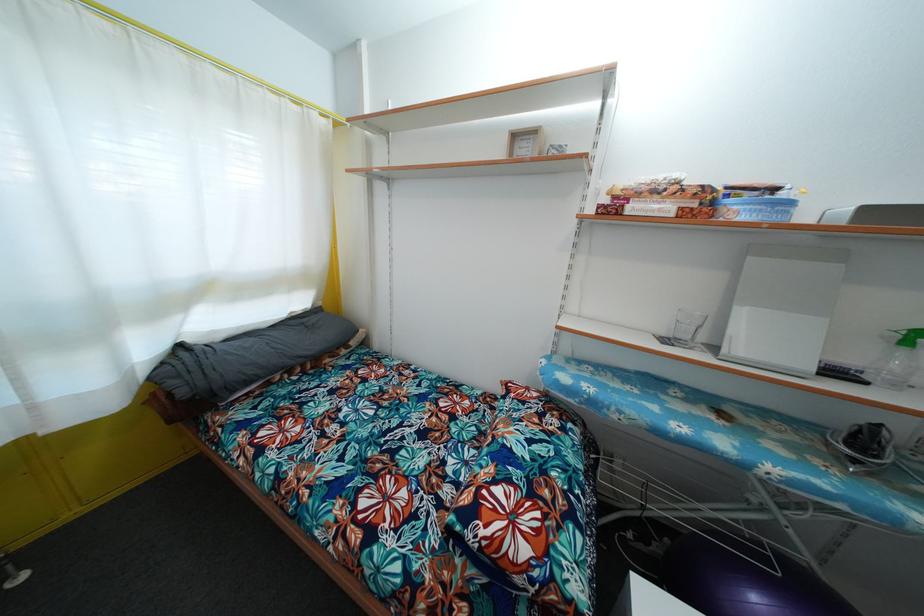
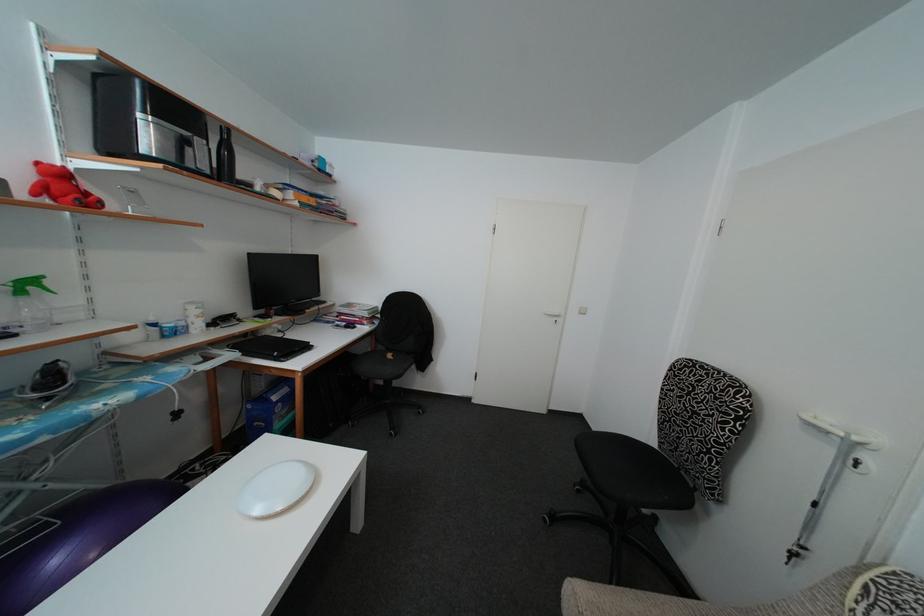
First-person continuous shooting, in which direction is the camera rotating?

The camera's rotation is toward right-down.